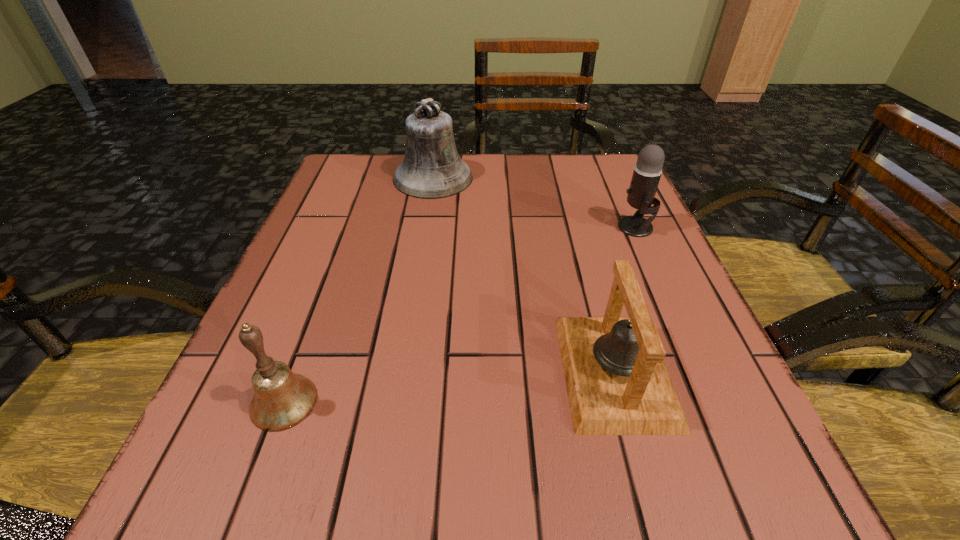
Identify the location of the second closest object to the rightmost bell. (282, 399).

Identify the location of bell that can be found as the closest to the rightmost bell. (282, 399).

I want to click on bell object that ranks as the third closest to the rightmost object, so click(282, 399).

I want to click on vacant area in the image that satisfies the following two spatial constraints: 1. on the back side of the farthest bell; 2. on the left side of the leftmost object, so click(368, 178).

What are the coordinates of `vacant area that satisfies the following two spatial constraints: 1. on the back side of the third object from left to right; 2. on the left side of the leftmost bell` in the screenshot? It's located at (296, 371).

The image size is (960, 540). What are the coordinates of `free spot that satisfies the following two spatial constraints: 1. on the back side of the leftmost bell; 2. on the left side of the rightmost object` in the screenshot? It's located at (349, 227).